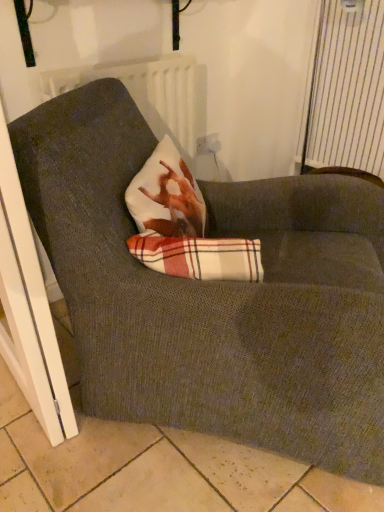
Question: Considering the relative positions of white plastic screen door at lower left and white striped curtain at upper right in the image provided, is white plastic screen door at lower left to the right of white striped curtain at upper right from the viewer's perspective?

Choices:
 (A) yes
 (B) no

Answer: (B)

Question: Does white plastic screen door at lower left have a greater height compared to white striped curtain at upper right?

Choices:
 (A) no
 (B) yes

Answer: (B)

Question: Does white plastic screen door at lower left have a greater width compared to white striped curtain at upper right?

Choices:
 (A) yes
 (B) no

Answer: (B)

Question: Can you confirm if white plastic screen door at lower left is shorter than white striped curtain at upper right?

Choices:
 (A) yes
 (B) no

Answer: (B)

Question: Is white striped curtain at upper right completely or partially inside white plastic screen door at lower left?

Choices:
 (A) no
 (B) yes

Answer: (A)

Question: Is white plastic screen door at lower left positioned before white striped curtain at upper right?

Choices:
 (A) no
 (B) yes

Answer: (B)

Question: Is plaid fabric at center not near white plastic screen door at lower left?

Choices:
 (A) yes
 (B) no

Answer: (B)

Question: Considering the relative positions of plaid fabric at center and white plastic screen door at lower left in the image provided, is plaid fabric at center behind white plastic screen door at lower left?

Choices:
 (A) yes
 (B) no

Answer: (A)

Question: Is plaid fabric at center facing towards white plastic screen door at lower left?

Choices:
 (A) no
 (B) yes

Answer: (A)

Question: Considering the relative positions of plaid fabric at center and white plastic screen door at lower left in the image provided, is plaid fabric at center to the right of white plastic screen door at lower left from the viewer's perspective?

Choices:
 (A) no
 (B) yes

Answer: (B)

Question: Can we say plaid fabric at center lies outside white plastic screen door at lower left?

Choices:
 (A) no
 (B) yes

Answer: (B)

Question: Is the position of plaid fabric at center less distant than that of white plastic screen door at lower left?

Choices:
 (A) yes
 (B) no

Answer: (B)

Question: Is white striped curtain at upper right bigger than white plastic electric outlet at upper center?

Choices:
 (A) yes
 (B) no

Answer: (A)